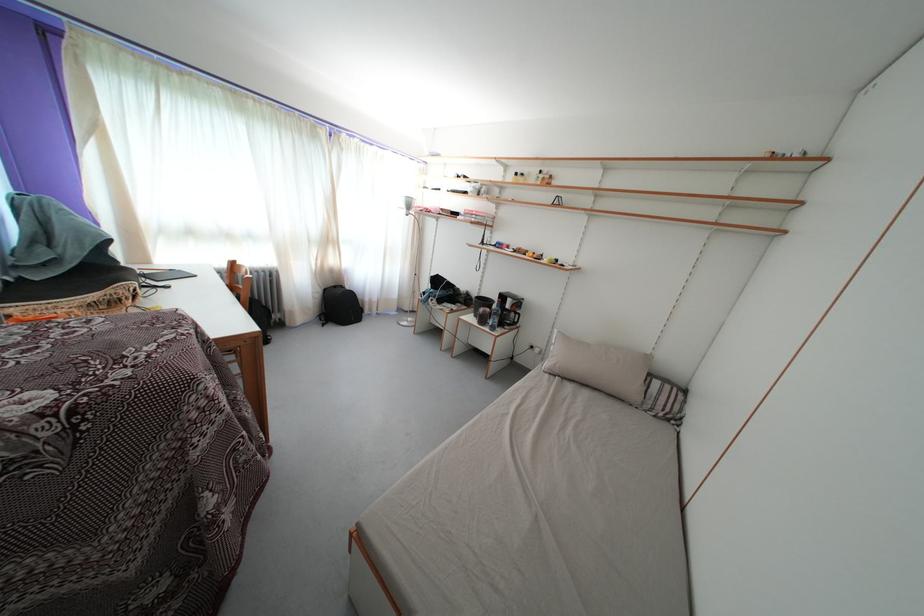
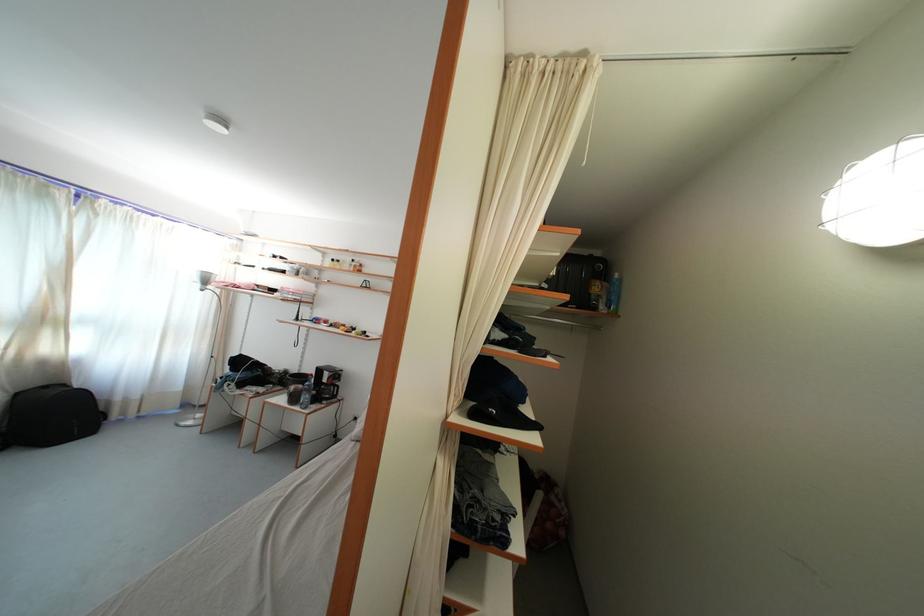
In the second image, find the point that corresponds to (332,296) in the first image.

(23, 400)